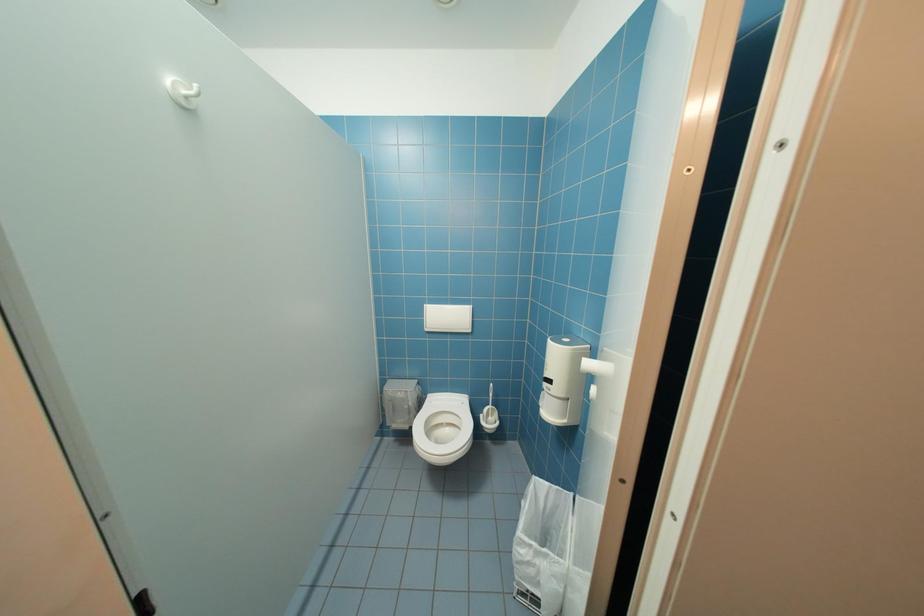
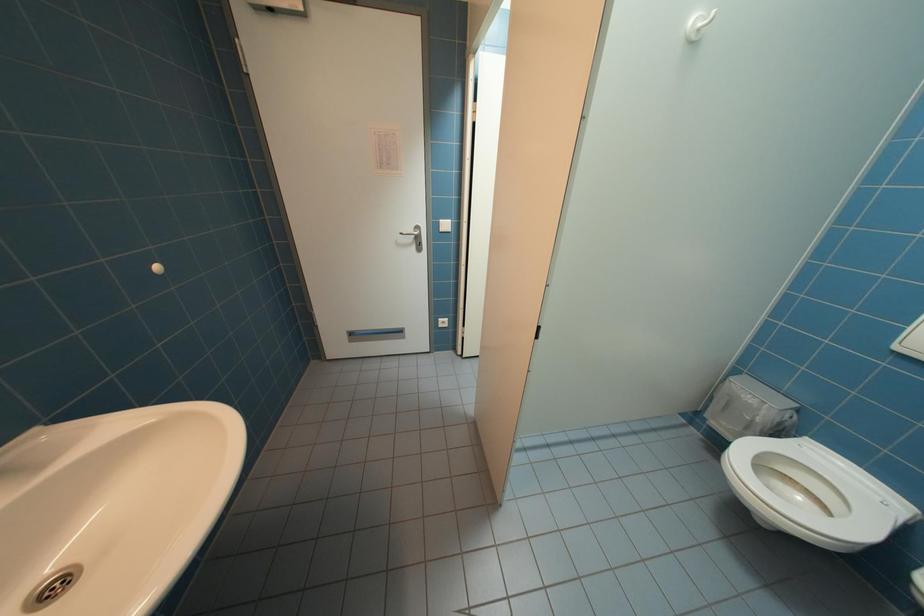
The first image is from the beginning of the video and the second image is from the end. How did the camera likely rotate when shooting the video?

The camera's rotation is toward left-down.